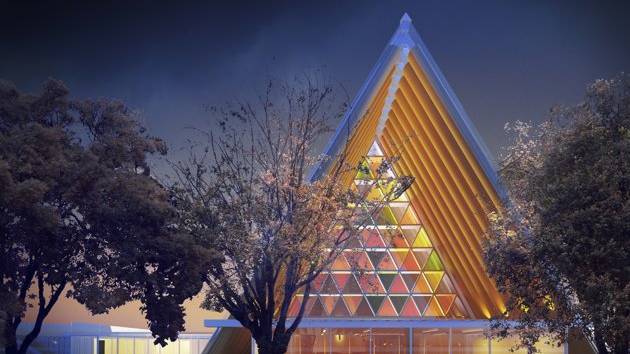
I want to click on lower right corner of glass triangle windows, so click(462, 310).